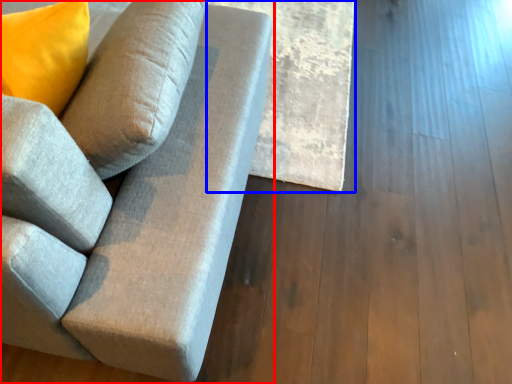
Question: Which object appears farthest to the camera in this image, studio couch (highlighted by a red box) or plank (highlighted by a blue box)?

Choices:
 (A) studio couch
 (B) plank

Answer: (B)